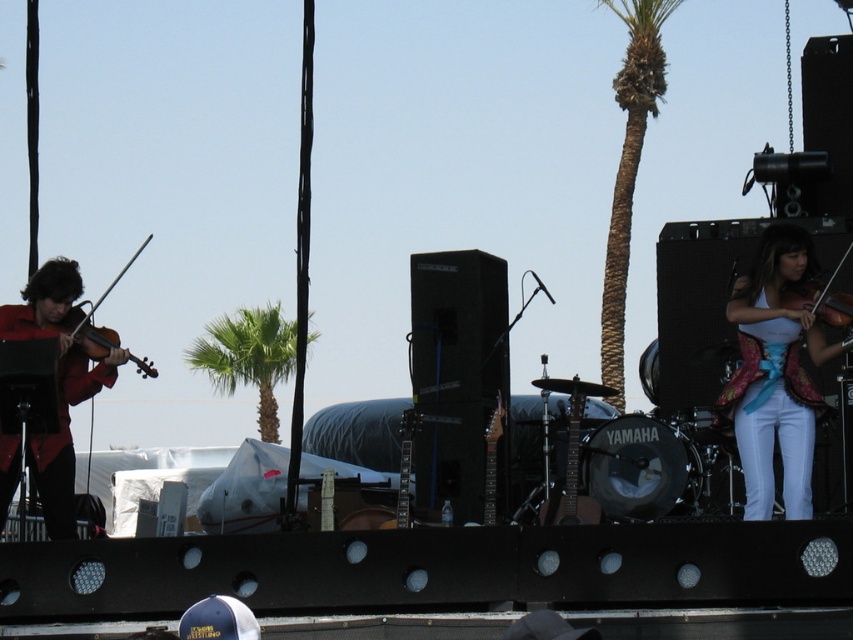
Does white satin vest at upper right have a greater height compared to brown textured palm tree at upper center?

In fact, white satin vest at upper right may be shorter than brown textured palm tree at upper center.

Which is above, white satin vest at upper right or brown textured palm tree at upper center?

Positioned higher is brown textured palm tree at upper center.

Between point (766, 320) and point (640, 49), which one is positioned in front?

Positioned in front is point (766, 320).

The height and width of the screenshot is (640, 853). Identify the location of white satin vest at upper right. (775, 372).

Consider the image. Is matte red violin at left bigger than brown textured palm tree at upper center?

No, matte red violin at left is not bigger than brown textured palm tree at upper center.

Is point (111, 381) farther from camera compared to point (625, 268)?

No, it is in front of (625, 268).

This screenshot has width=853, height=640. Identify the location of matte red violin at left. (57, 385).

From the picture: Can you confirm if brown textured palm tree at upper center is wider than green leafy palm tree at center?

No, brown textured palm tree at upper center is not wider than green leafy palm tree at center.

Is point (663, 52) in front of point (288, 346)?

Yes, point (663, 52) is closer to viewer.

You are a GUI agent. You are given a task and a screenshot of the screen. Output one action in this format:
    pyautogui.click(x=<x>, y=<y>)
    Task: Click on the brown textured palm tree at upper center
    Image resolution: width=853 pixels, height=640 pixels.
    Given the screenshot: What is the action you would take?
    pyautogui.click(x=630, y=164)